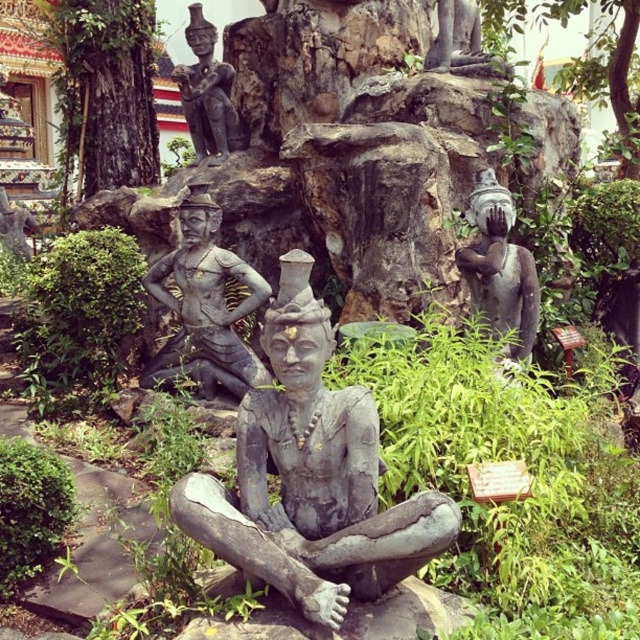
Is matte gray statue at right positioned in front of green leafy tree at upper right?

That is True.

Does matte gray statue at right have a smaller size compared to green leafy tree at upper right?

Correct, matte gray statue at right occupies less space than green leafy tree at upper right.

I want to click on matte gray statue at right, so click(x=499, y=266).

Describe the element at coordinates (97, 81) in the screenshot. This screenshot has height=640, width=640. I see `green rough bark tree at upper left` at that location.

Identify the location of green rough bark tree at upper left. (97, 81).

Does green rough bark tree at upper left have a smaller size compared to matte gray statue at center?

No, green rough bark tree at upper left is not smaller than matte gray statue at center.

Is point (100, 140) closer to camera compared to point (212, 275)?

No.

The width and height of the screenshot is (640, 640). What do you see at coordinates (97, 81) in the screenshot? I see `green rough bark tree at upper left` at bounding box center [97, 81].

This screenshot has width=640, height=640. I want to click on green rough bark tree at upper left, so click(97, 81).